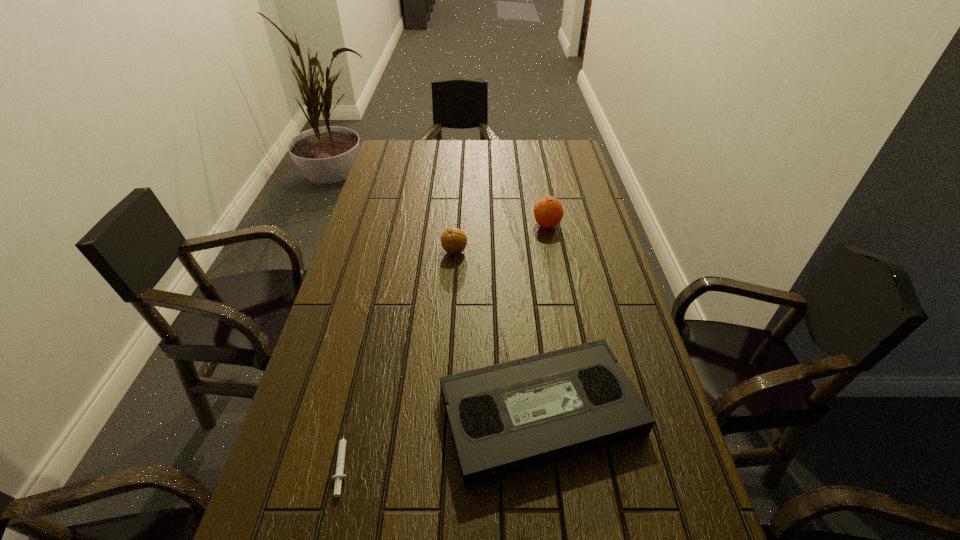
Locate an element on the screen. This screenshot has width=960, height=540. vacant space located on the front of the shortest object is located at coordinates (326, 532).

The image size is (960, 540). Find the location of `object located in the left edge section of the desktop`. object located in the left edge section of the desktop is located at coordinates [x=339, y=475].

Find the location of `orange that is at the right edge`. orange that is at the right edge is located at coordinates (548, 211).

You are a GUI agent. You are given a task and a screenshot of the screen. Output one action in this format:
    pyautogui.click(x=<x>, y=<y>)
    Task: Click on the videotape that is at the right edge
    The width and height of the screenshot is (960, 540).
    Given the screenshot: What is the action you would take?
    pyautogui.click(x=505, y=418)

In the image, there is a desktop. Where is `vacant region at the far edge`? This screenshot has height=540, width=960. vacant region at the far edge is located at coordinates (486, 154).

Find the location of a particular element. This screenshot has height=540, width=960. free space at the left edge is located at coordinates (307, 451).

Where is `free space at the right edge of the desktop`? free space at the right edge of the desktop is located at coordinates (643, 513).

This screenshot has width=960, height=540. I want to click on free space between the second farthest object and the right orange, so click(501, 238).

At what (x,y) coordinates should I click in order to perform the action: click on vacant area between the leftmost object and the tallest object. Please return your answer as a coordinate pair (x, y). This screenshot has height=540, width=960. Looking at the image, I should click on (445, 342).

At what (x,y) coordinates should I click in order to perform the action: click on free space between the second farthest object and the third tallest object. Please return your answer as a coordinate pair (x, y). Image resolution: width=960 pixels, height=540 pixels. Looking at the image, I should click on (497, 332).